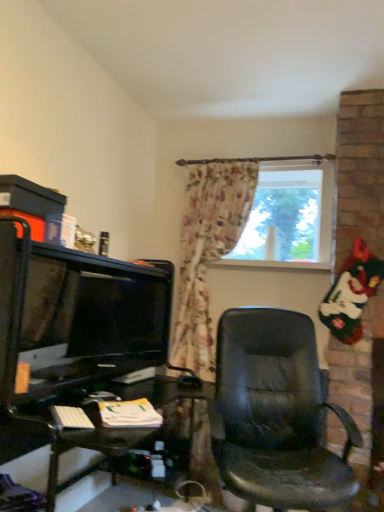
Question: From their relative heights in the image, would you say transparent glass window at center is taller or shorter than matte black monitor at left?

Choices:
 (A) short
 (B) tall

Answer: (B)

Question: In the image, is transparent glass window at center positioned in front of or behind matte black monitor at left?

Choices:
 (A) behind
 (B) front

Answer: (A)

Question: Is transparent glass window at center wider or thinner than matte black monitor at left?

Choices:
 (A) thin
 (B) wide

Answer: (A)

Question: Is matte black monitor at left in front of or behind transparent glass window at center in the image?

Choices:
 (A) front
 (B) behind

Answer: (A)

Question: From a real-world perspective, is matte black monitor at left physically located above or below transparent glass window at center?

Choices:
 (A) above
 (B) below

Answer: (B)

Question: From their relative heights in the image, would you say matte black monitor at left is taller or shorter than transparent glass window at center?

Choices:
 (A) short
 (B) tall

Answer: (A)

Question: From the image's perspective, relative to transparent glass window at center, is matte black monitor at left above or below?

Choices:
 (A) above
 (B) below

Answer: (B)